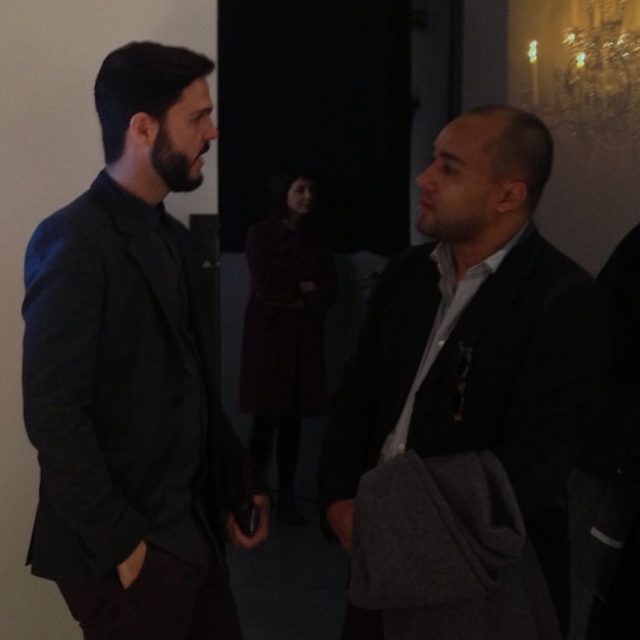
Question: Can you confirm if matte black jacket at right is positioned to the right of dark gray suit at right?

Choices:
 (A) no
 (B) yes

Answer: (A)

Question: Estimate the real-world distances between objects in this image. Which object is closer to the dark gray suit at right?

Choices:
 (A) matte black suit at left
 (B) matte black jacket at right

Answer: (B)

Question: Does matte black suit at left appear on the left side of matte black jacket at right?

Choices:
 (A) yes
 (B) no

Answer: (A)

Question: Which is farther from the matte black suit at left?

Choices:
 (A) matte black jacket at right
 (B) dark gray suit at right

Answer: (B)

Question: Is matte black suit at left below dark gray suit at right?

Choices:
 (A) no
 (B) yes

Answer: (A)

Question: Which is farther from the matte black jacket at right?

Choices:
 (A) matte black suit at left
 (B) dark gray suit at right

Answer: (A)